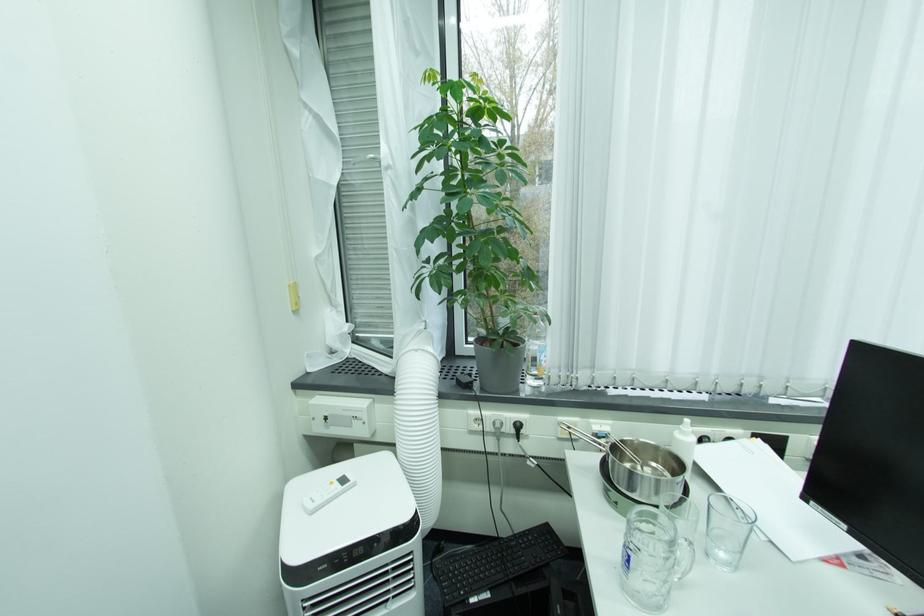
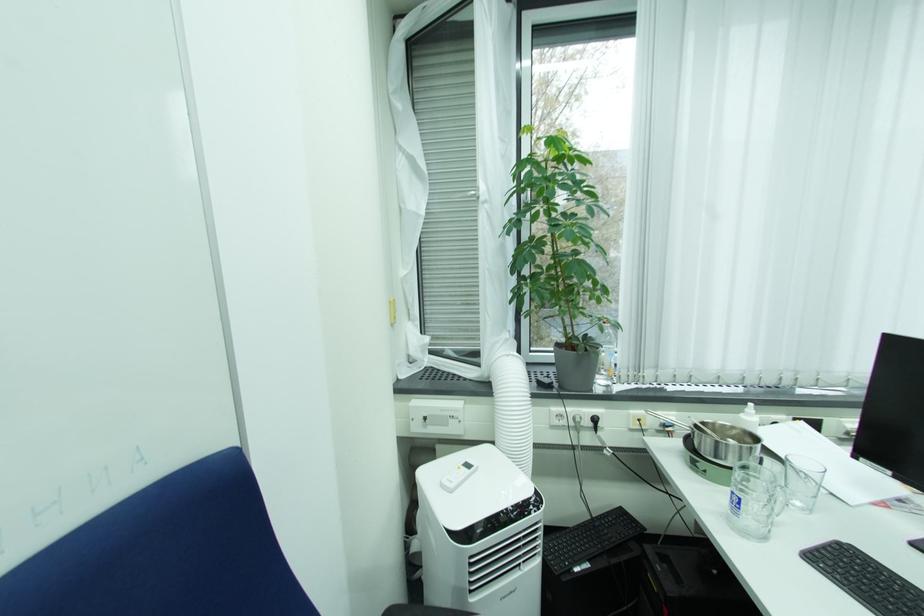
In a continuous first-person perspective shot, in which direction is the camera moving?

The cameraman moved toward left, backward.